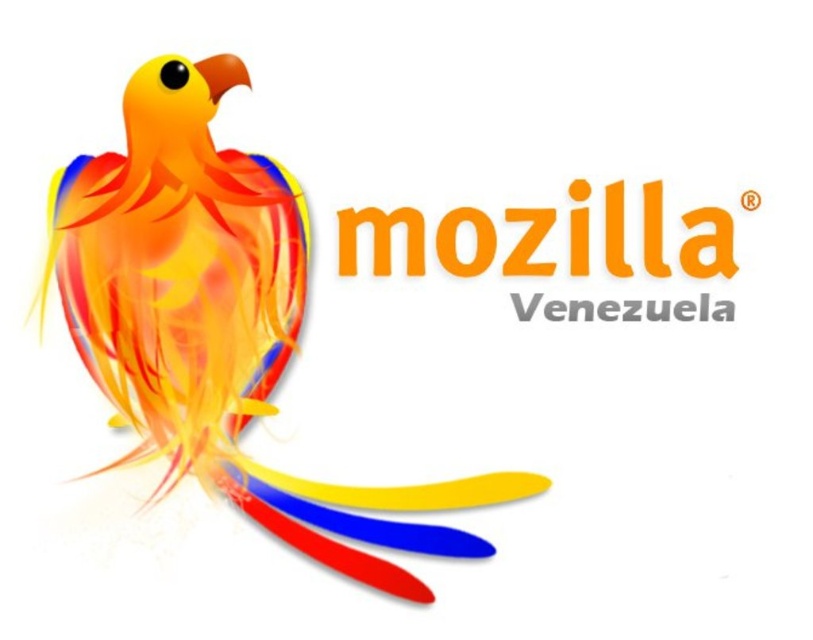
Between point (198, 340) and point (574, 308), which one is positioned behind?

Point (574, 308)

In the scene shown: Is shiny multicolored parrot at left thinner than gray matte venezuela at center?

No, shiny multicolored parrot at left is not thinner than gray matte venezuela at center.

The height and width of the screenshot is (640, 813). Find the location of `shiny multicolored parrot at left`. shiny multicolored parrot at left is located at coordinates (218, 321).

The image size is (813, 640). What are the coordinates of `shiny multicolored parrot at left` in the screenshot? It's located at (218, 321).

Is point (540, 269) less distant than point (661, 307)?

No, it is not.

Which of these two, orange matte logo at center or gray matte venezuela at center, stands taller?

orange matte logo at center

Does point (468, 224) lie in front of point (522, 308)?

No, (468, 224) is further to viewer.

Locate an element on the screen. This screenshot has width=813, height=640. orange matte logo at center is located at coordinates click(x=381, y=237).

Which is above, shiny multicolored parrot at left or orange matte logo at center?

Positioned higher is orange matte logo at center.

Where is `shiny multicolored parrot at left`? Image resolution: width=813 pixels, height=640 pixels. shiny multicolored parrot at left is located at coordinates (218, 321).